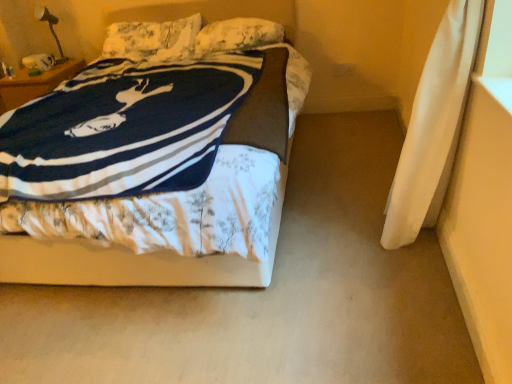
Question: Is fluffy white pillow at upper center, arranged as the first pillow when viewed from the left, aimed at white floral fabric bed at center?

Choices:
 (A) no
 (B) yes

Answer: (B)

Question: From a real-world perspective, is fluffy white pillow at upper center, arranged as the first pillow when viewed from the left, under white floral fabric bed at center?

Choices:
 (A) no
 (B) yes

Answer: (A)

Question: From a real-world perspective, is fluffy white pillow at upper center, arranged as the 2th pillow when viewed from the right, on white floral fabric bed at center?

Choices:
 (A) no
 (B) yes

Answer: (B)

Question: Does fluffy white pillow at upper center, arranged as the 2th pillow when viewed from the right, appear on the right side of white floral fabric bed at center?

Choices:
 (A) yes
 (B) no

Answer: (B)

Question: Is fluffy white pillow at upper center, arranged as the 2th pillow when viewed from the right, facing away from white floral fabric bed at center?

Choices:
 (A) yes
 (B) no

Answer: (A)

Question: From a real-world perspective, is fluffy white pillow at upper center, the 1th pillow when ordered from right to left, positioned above or below white floral fabric bed at center?

Choices:
 (A) below
 (B) above

Answer: (B)

Question: Is fluffy white pillow at upper center, which is the second pillow from left to right, to the left or to the right of white floral fabric bed at center in the image?

Choices:
 (A) left
 (B) right

Answer: (B)

Question: Is fluffy white pillow at upper center, the 1th pillow when ordered from right to left, inside or outside of white floral fabric bed at center?

Choices:
 (A) outside
 (B) inside

Answer: (B)

Question: From the image's perspective, is fluffy white pillow at upper center, the 1th pillow when ordered from right to left, positioned above or below white floral fabric bed at center?

Choices:
 (A) below
 (B) above

Answer: (B)

Question: Is point pos(181,14) positioned closer to the camera than point pos(121,31)?

Choices:
 (A) closer
 (B) farther

Answer: (A)

Question: Is white floral fabric bed at center in front of or behind fluffy white pillow at upper center, arranged as the 2th pillow when viewed from the right, in the image?

Choices:
 (A) behind
 (B) front

Answer: (B)

Question: Is white floral fabric bed at center inside or outside of fluffy white pillow at upper center, arranged as the 2th pillow when viewed from the right?

Choices:
 (A) outside
 (B) inside

Answer: (A)

Question: From the image's perspective, is white floral fabric bed at center positioned above or below fluffy white pillow at upper center, arranged as the first pillow when viewed from the left?

Choices:
 (A) above
 (B) below

Answer: (B)

Question: Considering the positions of fluffy white pillow at upper center, arranged as the 2th pillow when viewed from the right, and fluffy white pillow at upper center, which is the second pillow from left to right, in the image, is fluffy white pillow at upper center, arranged as the 2th pillow when viewed from the right, taller or shorter than fluffy white pillow at upper center, which is the second pillow from left to right,?

Choices:
 (A) tall
 (B) short

Answer: (A)

Question: Which is correct: fluffy white pillow at upper center, arranged as the 2th pillow when viewed from the right, is inside fluffy white pillow at upper center, the 1th pillow when ordered from right to left, or outside of it?

Choices:
 (A) outside
 (B) inside

Answer: (A)